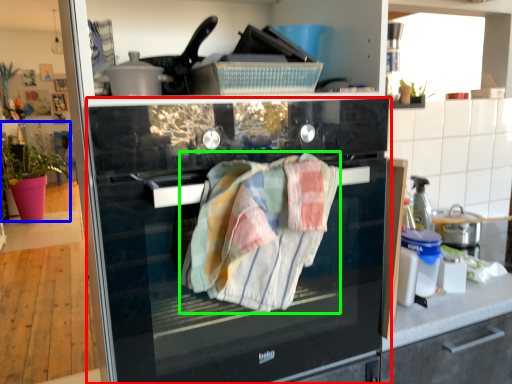
Question: Which object is the closest to the home appliance (highlighted by a red box)? Choose among these: plant (highlighted by a blue box) or bath towel (highlighted by a green box).

Choices:
 (A) plant
 (B) bath towel

Answer: (B)